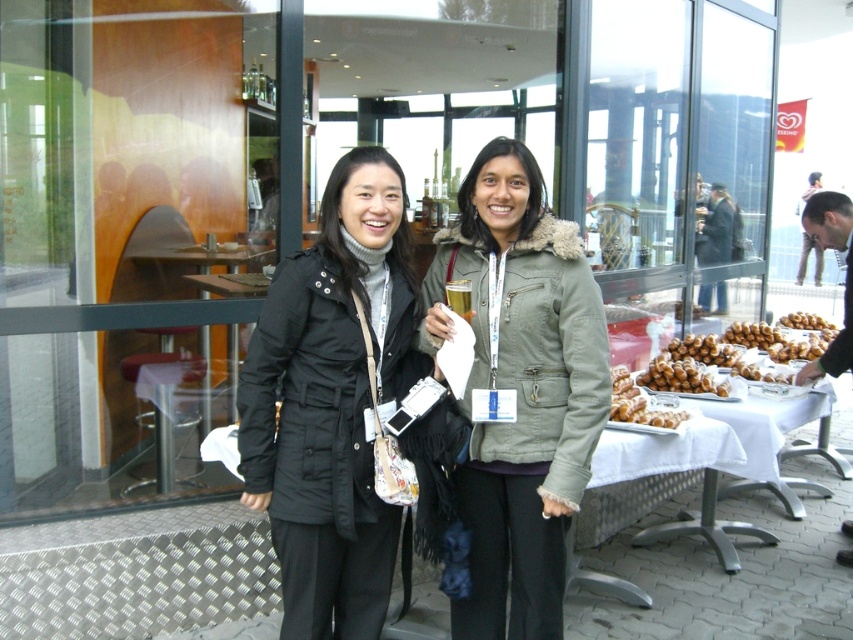
In the scene shown: You are standing in front of the glass window at the cafe. There is a white tablecloth at lower right marked by point (642, 486). If you want to place your drink on the table, where should you aim?

The white tablecloth at lower right is marked by point (642, 486), so you should aim for that location to place your drink on the table.

You are a photographer trying to capture a photo of the olive green jacket at center and the white cloth table at right. Which object should you focus on first if you want to ensure both are in focus without adjusting your camera settings?

The olive green jacket at center is much taller than the white cloth table at right, so you should focus on the olive green jacket at center first to ensure both are in focus.

You are standing in front of the glass window at the outdoor area. There are two points marked on the window. One is at coordinate point (592, 435) and the other is at point (767, 451). Which point is closer to you?

Point (592, 435) is closer to the viewer than point (767, 451).